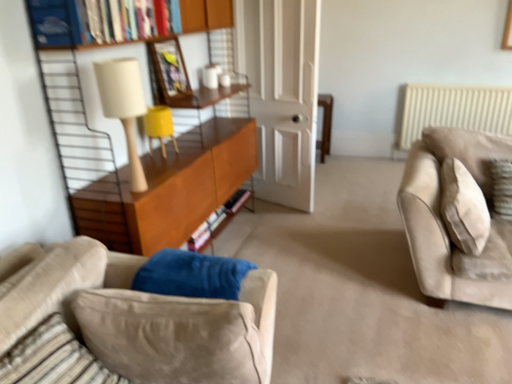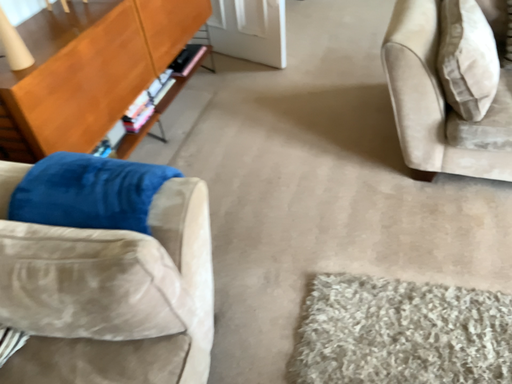
Question: Which way did the camera rotate in the video?

Choices:
 (A) rotated downward
 (B) rotated upward

Answer: (A)